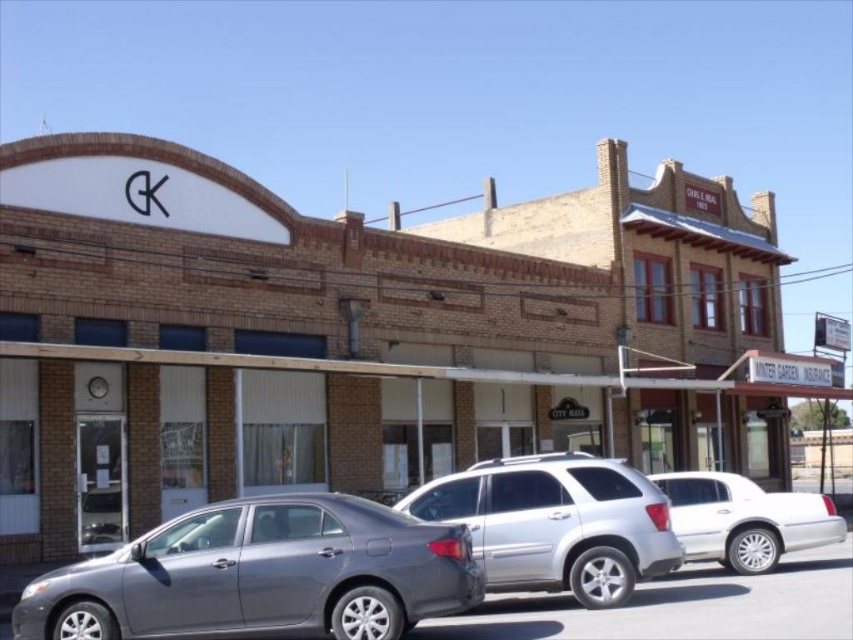
In the scene shown: Is satin silver sedan at center further to camera compared to white metallic sedan at right?

No, satin silver sedan at center is closer to the viewer.

Is point (346, 564) positioned before point (701, 486)?

Yes, point (346, 564) is closer to viewer.

Who is more distant from viewer, (x=318, y=554) or (x=692, y=518)?

Positioned behind is point (x=692, y=518).

Identify the location of satin silver sedan at center. (260, 573).

Can you confirm if satin silver sedan at center is positioned to the right of silver metallic suv at center?

Incorrect, satin silver sedan at center is not on the right side of silver metallic suv at center.

Who is lower down, satin silver sedan at center or silver metallic suv at center?

satin silver sedan at center is below.

The width and height of the screenshot is (853, 640). Describe the element at coordinates (260, 573) in the screenshot. I see `satin silver sedan at center` at that location.

This screenshot has width=853, height=640. Identify the location of satin silver sedan at center. (260, 573).

Locate an element on the screen. This screenshot has height=640, width=853. silver metallic suv at center is located at coordinates pyautogui.click(x=556, y=524).

Between silver metallic suv at center and white metallic sedan at right, which one appears on the right side from the viewer's perspective?

→ From the viewer's perspective, white metallic sedan at right appears more on the right side.

At what (x,y) coordinates should I click in order to perform the action: click on silver metallic suv at center. Please return your answer as a coordinate pair (x, y). The image size is (853, 640). Looking at the image, I should click on (556, 524).